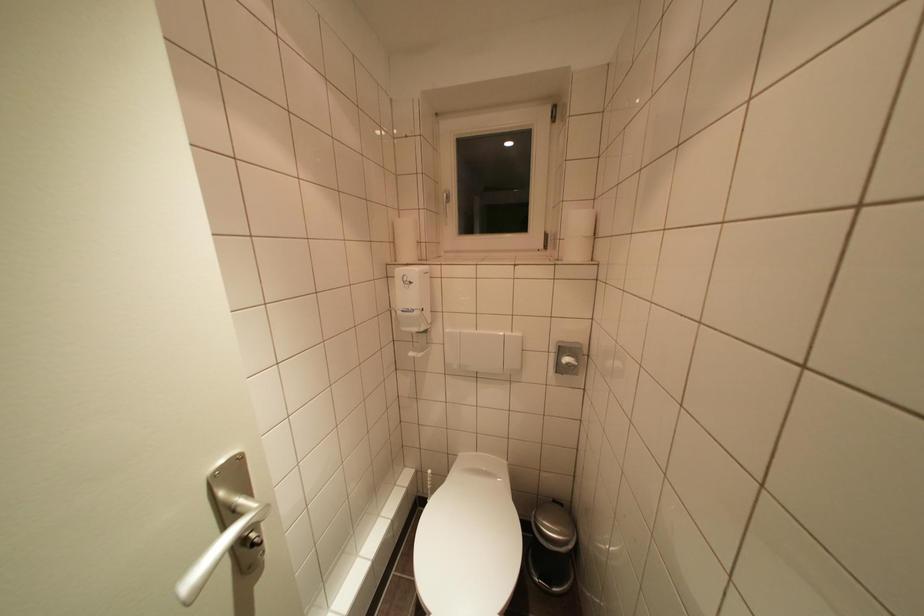
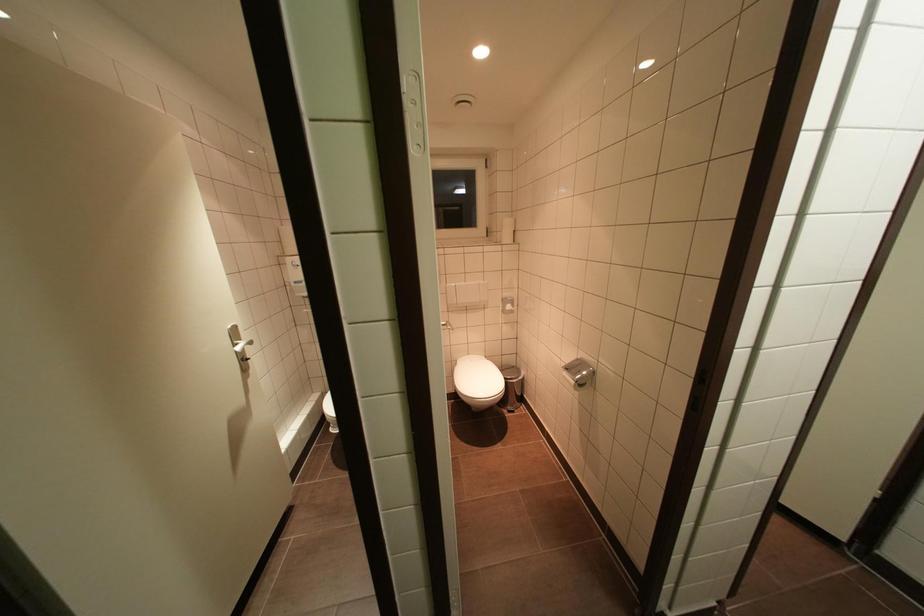
Question: In a continuous first-person perspective shot, in which direction is the camera moving?

Choices:
 (A) Left
 (B) Right
 (C) Forward
 (D) Backward

Answer: (D)